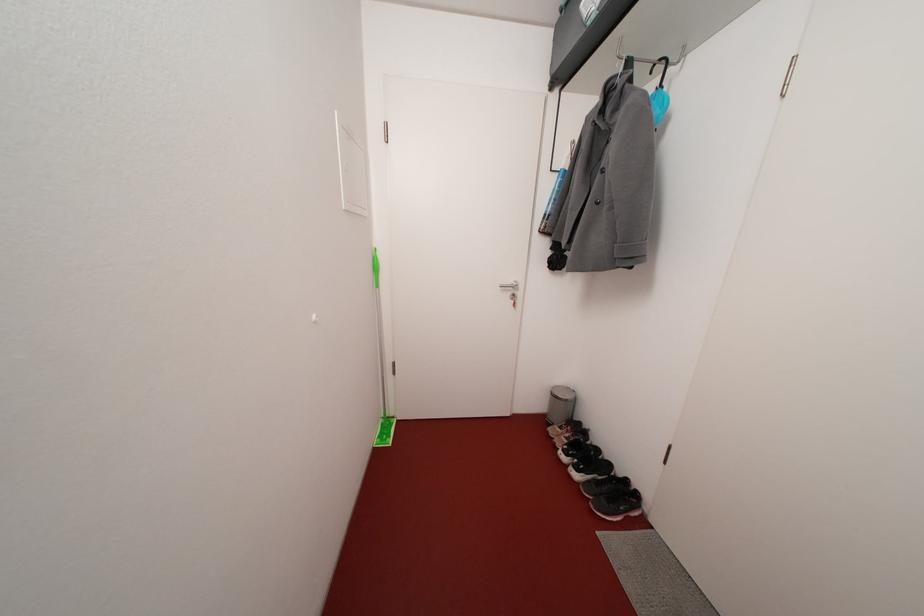
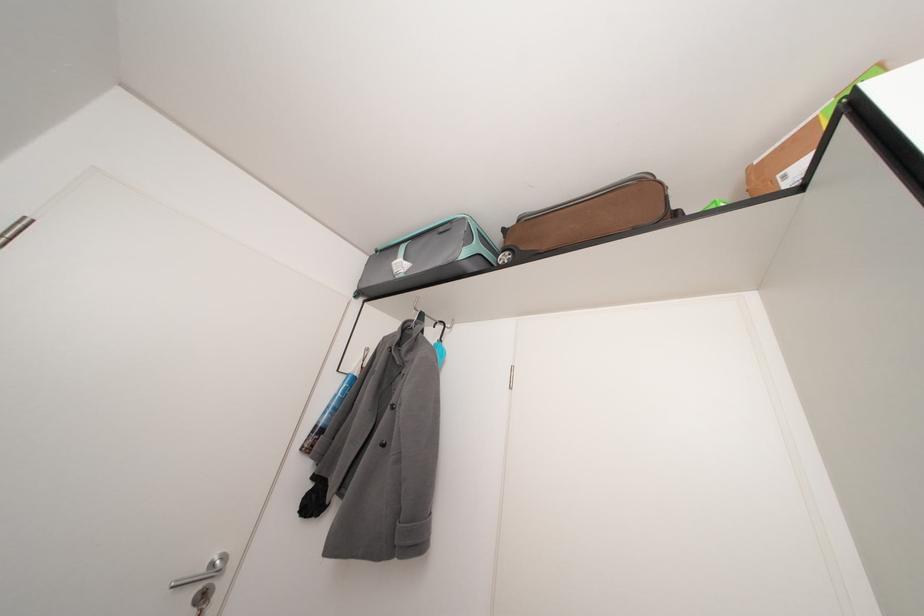
The first image is from the beginning of the video and the second image is from the end. How did the camera likely rotate when shooting the video?

The camera rotated toward right-up.